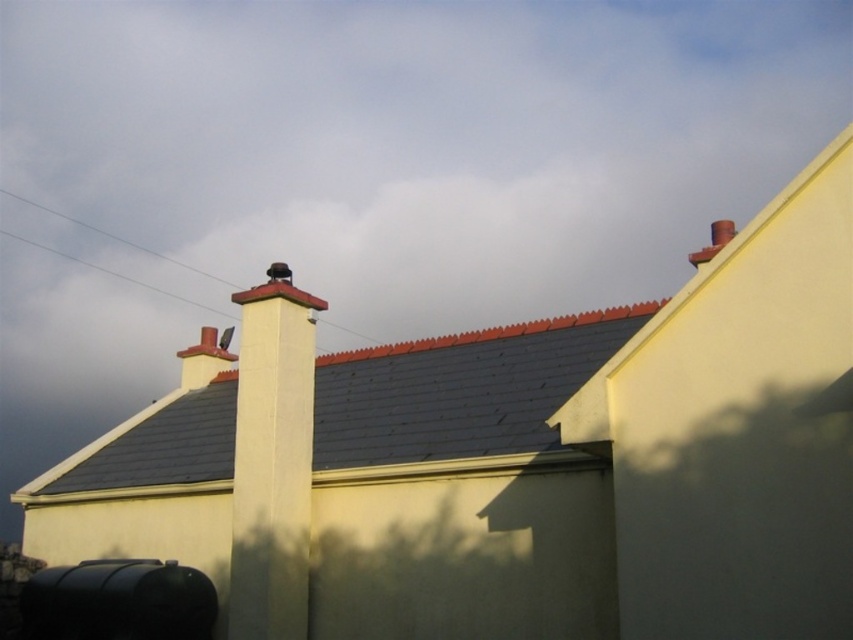
You are a drone operator trying to navigate between two points on the roof of a building. The first point is point (514, 376) and the second is point (294, 536). According to the scene, which point is closer to the edge of the roof?

Point (294, 536) is closer to the edge of the roof because it is in front of point (514, 376), which is behind it.